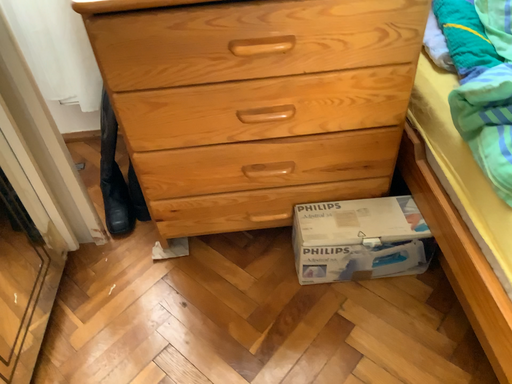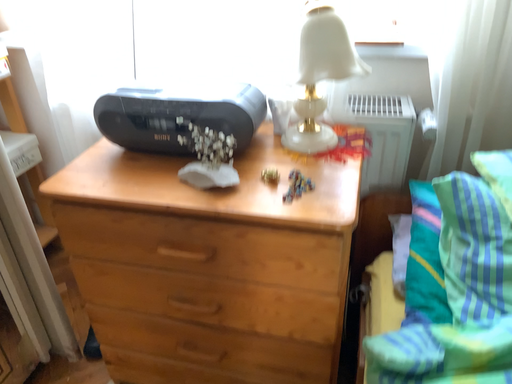
Question: How did the camera likely rotate when shooting the video?

Choices:
 (A) rotated downward
 (B) rotated upward

Answer: (B)